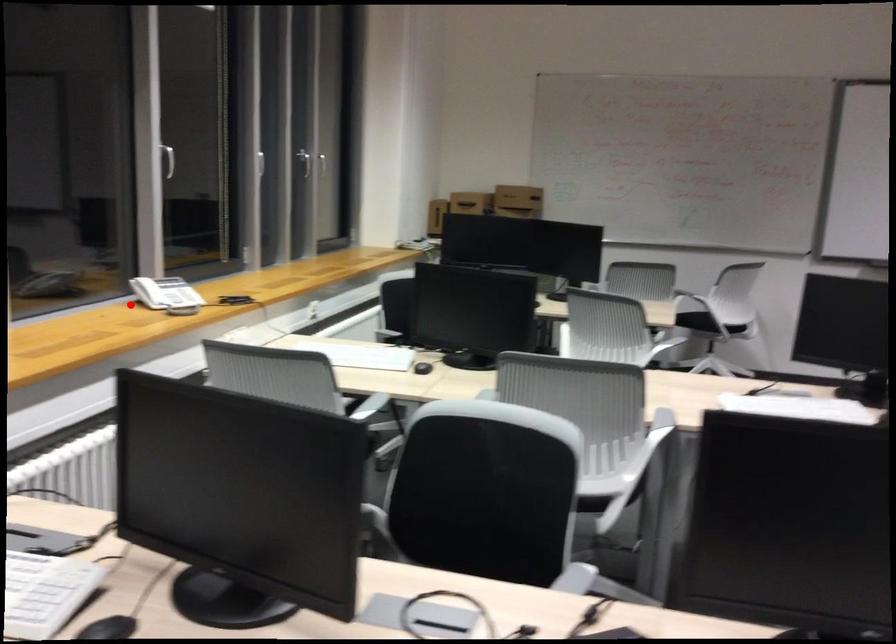
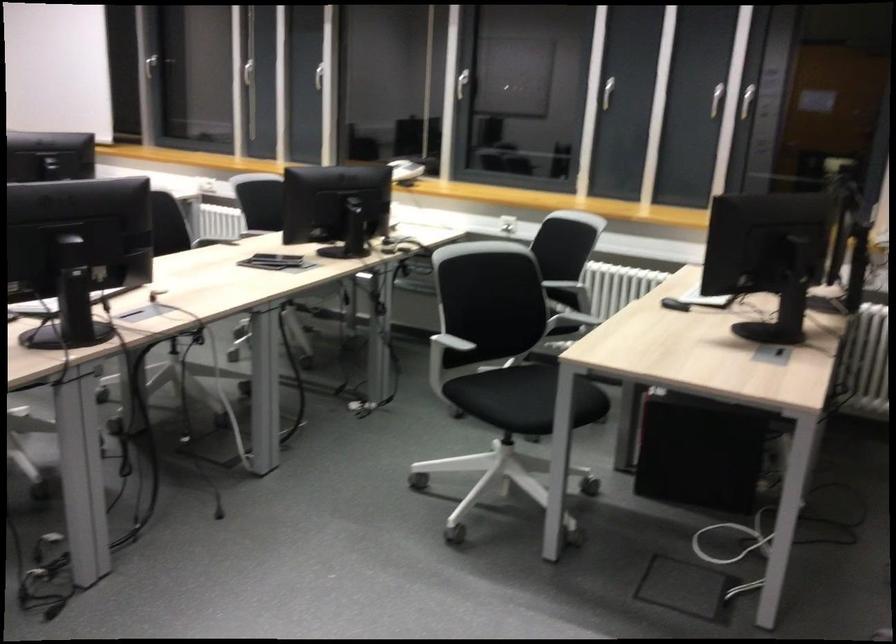
Question: I am providing you with two images of the same scene from different viewpoints. Given a red point in image1, look at the same physical point in image2. Is it:

Choices:
 (A) Closer to the viewpoint
 (B) Farther from the viewpoint

Answer: (B)